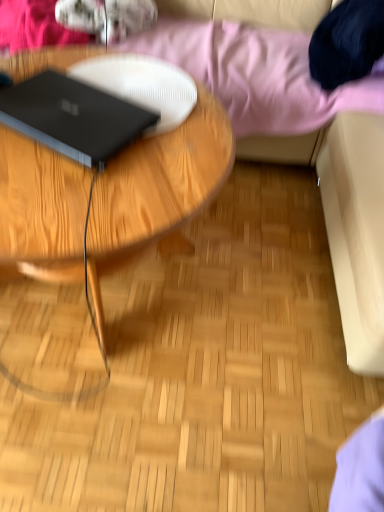
The width and height of the screenshot is (384, 512). Identify the location of vacant area that is in front of black matte laptop at left. (64, 192).